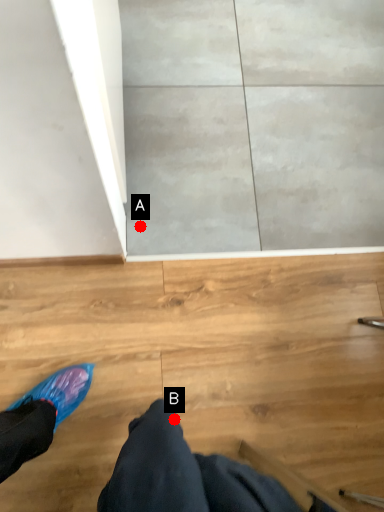
Question: Two points are circled on the image, labeled by A and B beside each circle. Among these points, which one is farthest from the camera?

Choices:
 (A) A is further
 (B) B is further

Answer: (A)